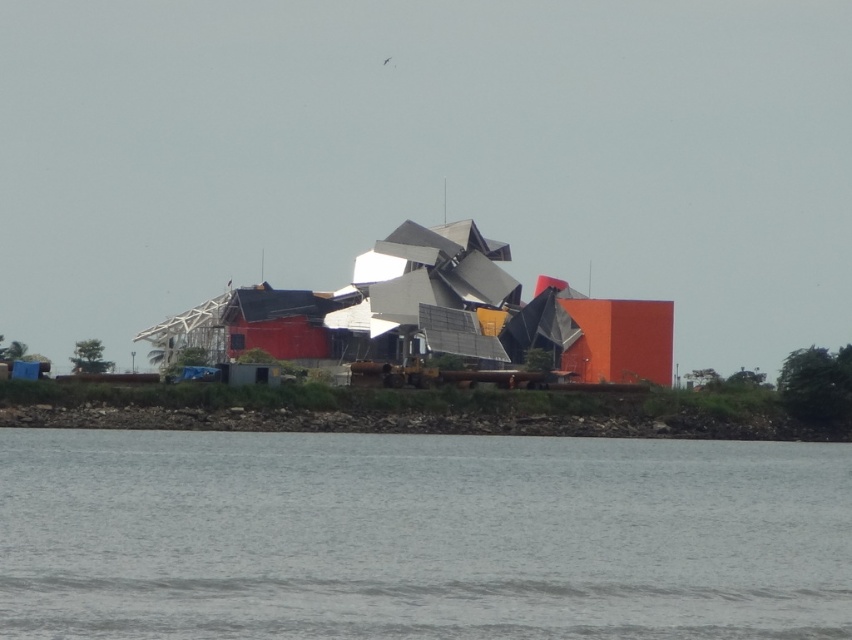
Question: Does gray water at lower center appear under brown dirt at lower center?

Choices:
 (A) no
 (B) yes

Answer: (A)

Question: Does gray water at lower center have a larger size compared to brown dirt at lower center?

Choices:
 (A) no
 (B) yes

Answer: (B)

Question: Which of the following is the farthest from the observer?

Choices:
 (A) gray water at lower center
 (B) brown dirt at lower center

Answer: (B)

Question: Which of the following is the closest to the observer?

Choices:
 (A) (91, 388)
 (B) (597, 449)

Answer: (B)

Question: Which point is closer to the camera taking this photo?

Choices:
 (A) (111, 417)
 (B) (375, 544)

Answer: (B)

Question: Where is gray water at lower center located in relation to brown dirt at lower center in the image?

Choices:
 (A) above
 (B) below

Answer: (A)